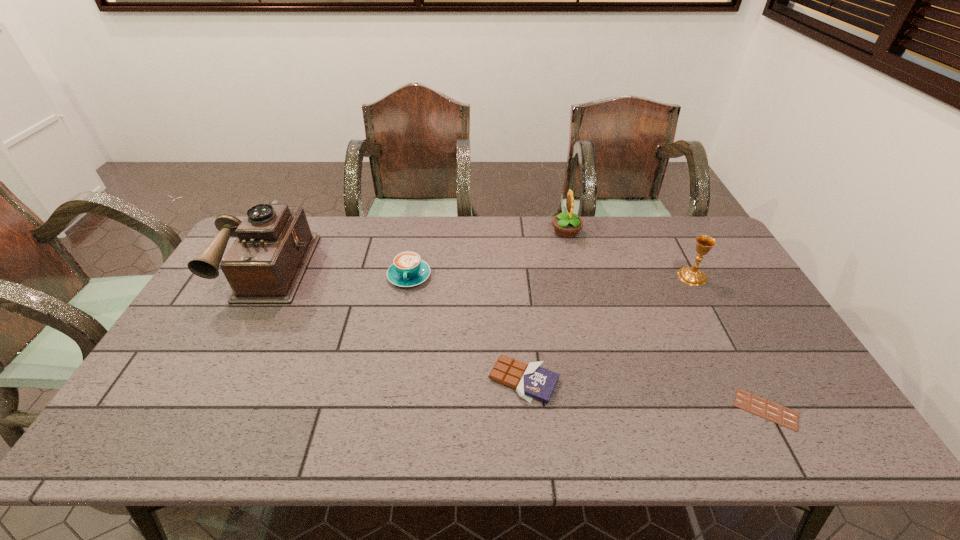
This screenshot has width=960, height=540. Identify the location of empty space between the shortest object and the sunflower. [x=666, y=320].

Identify the location of object that can be found as the third closest to the second object from left to right. The height and width of the screenshot is (540, 960). (566, 225).

The height and width of the screenshot is (540, 960). Identify the location of object that is the second closest to the phonograph_record. (531, 381).

Locate an element on the screen. This screenshot has height=540, width=960. vacant space that satisfies the following two spatial constraints: 1. on the face of the third object from right to left; 2. with the handle on the right side of the cappuccino is located at coordinates (577, 276).

You are a GUI agent. You are given a task and a screenshot of the screen. Output one action in this format:
    pyautogui.click(x=<x>, y=<y>)
    Task: Click on the free point that satisfies the following two spatial constraints: 1. on the face of the fourth object from left to right; 2. with the handle on the right side of the cappuccino
    
    Given the screenshot: What is the action you would take?
    pyautogui.click(x=577, y=276)

The height and width of the screenshot is (540, 960). What are the coordinates of `vacant position in the image that satisfies the following two spatial constraints: 1. on the face of the third object from right to left; 2. on the back side of the shortest object` in the screenshot? It's located at (610, 409).

At what (x,y) coordinates should I click in order to perform the action: click on vacant space that satisfies the following two spatial constraints: 1. on the horn of the chalice; 2. on the right side of the tallest object. Please return your answer as a coordinate pair (x, y). Looking at the image, I should click on (263, 276).

At what (x,y) coordinates should I click in order to perform the action: click on free space in the image that satisfies the following two spatial constraints: 1. on the front side of the fifth tallest object; 2. on the right side of the shorter chocolate bar. Please return your answer as a coordinate pair (x, y). Image resolution: width=960 pixels, height=540 pixels. Looking at the image, I should click on (526, 409).

Where is `free location that satisfies the following two spatial constraints: 1. on the face of the sunflower; 2. on the back side of the chalice`? free location that satisfies the following two spatial constraints: 1. on the face of the sunflower; 2. on the back side of the chalice is located at coordinates (577, 276).

Locate an element on the screen. The width and height of the screenshot is (960, 540). vacant space that satisfies the following two spatial constraints: 1. with the handle on the right side of the left chocolate bar; 2. on the left side of the second object from left to right is located at coordinates (391, 380).